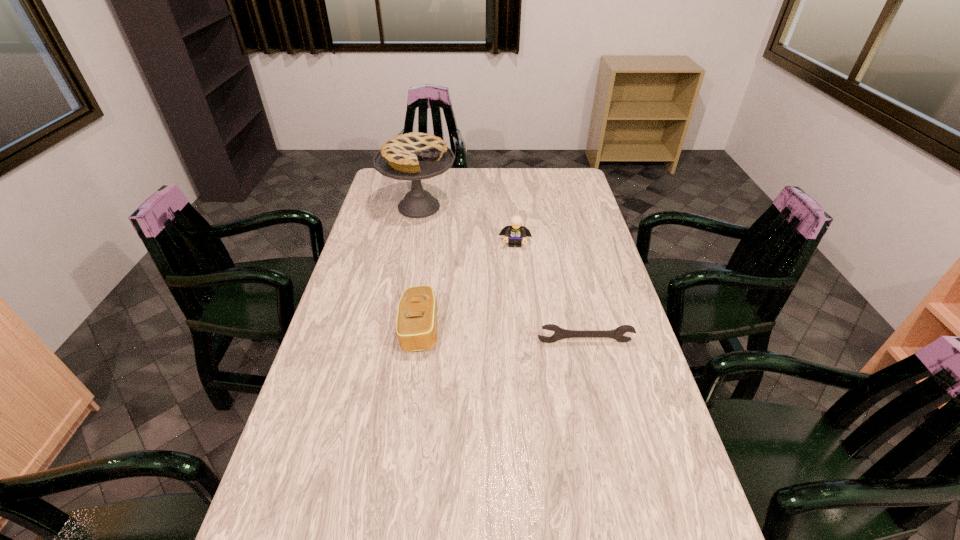
Image resolution: width=960 pixels, height=540 pixels. I want to click on unoccupied area between the clutch bag and the farthest object, so click(420, 268).

Locate an element on the screen. Image resolution: width=960 pixels, height=540 pixels. object that is the second nearest to the farthest object is located at coordinates tap(416, 326).

The width and height of the screenshot is (960, 540). Identify the location of object that stands as the second closest to the Lego. (416, 326).

Image resolution: width=960 pixels, height=540 pixels. In order to click on blank area in the image that satisfies the following two spatial constraints: 1. on the front side of the farthest object; 2. on the left side of the third nearest object in this screenshot , I will do `click(412, 244)`.